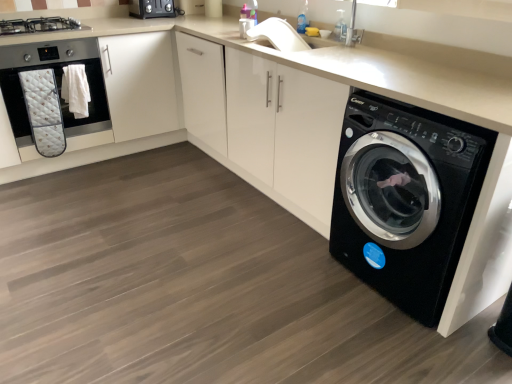
The width and height of the screenshot is (512, 384). Describe the element at coordinates (57, 84) in the screenshot. I see `matte black oven at left` at that location.

You are a GUI agent. You are given a task and a screenshot of the screen. Output one action in this format:
    pyautogui.click(x=<x>, y=<y>)
    Task: Click on the satin black toaster at upper center
    This screenshot has width=512, height=384.
    Given the screenshot: What is the action you would take?
    pyautogui.click(x=152, y=9)

In order to face satin black toaster at upper center, should I rotate leftwards or rightwards?

Turn left by 13.423 degrees to look at satin black toaster at upper center.

Identify the location of matte black oven at left. The image size is (512, 384). (57, 84).

Considering the positions of points (152, 14) and (24, 24), is point (152, 14) farther from camera compared to point (24, 24)?

Yes, it is behind point (24, 24).

From the image's perspective, is satin black toaster at upper center positioned above or below satin black stove at upper left?

satin black toaster at upper center is situated higher than satin black stove at upper left in the image.

Is satin black toaster at upper center positioned in front of satin black stove at upper left?

No, the depth of satin black toaster at upper center is greater than that of satin black stove at upper left.

Considering the sizes of objects satin black toaster at upper center and satin black stove at upper left in the image provided, who is taller, satin black toaster at upper center or satin black stove at upper left?

satin black toaster at upper center is taller.

Considering the positions of objects matte black oven at left and black glossy washing machine at lower right in the image provided, who is behind, matte black oven at left or black glossy washing machine at lower right?

matte black oven at left is further away from the camera.

Is matte black oven at left aimed at black glossy washing machine at lower right?

Yes, matte black oven at left is oriented towards black glossy washing machine at lower right.

Is point (41, 44) more distant than point (481, 181)?

Yes, it is behind point (481, 181).

Is matte black oven at left placed right next to black glossy washing machine at lower right?

matte black oven at left and black glossy washing machine at lower right are clearly separated.

Considering the sizes of objects matte black oven at left and satin black toaster at upper center in the image provided, who is wider, matte black oven at left or satin black toaster at upper center?

Wider between the two is matte black oven at left.

Can you confirm if matte black oven at left is bigger than satin black toaster at upper center?

Yes, matte black oven at left is bigger than satin black toaster at upper center.

Between point (62, 54) and point (134, 15), which one is positioned behind?

The point (134, 15) is more distant.

Between matte black oven at left and satin black toaster at upper center, which one is positioned in front?

matte black oven at left is more forward.

What's the angular difference between satin black toaster at upper center and black glossy washing machine at lower right's facing directions?

The facing directions of satin black toaster at upper center and black glossy washing machine at lower right are 90.1 degrees apart.

Is satin black toaster at upper center not inside black glossy washing machine at lower right?

That's correct, satin black toaster at upper center is outside of black glossy washing machine at lower right.

Identify the location of washing machine in front of the satin black toaster at upper center. This screenshot has height=384, width=512. (406, 199).

Considering the sizes of matte black oven at left and satin black stove at upper left in the image, is matte black oven at left wider or thinner than satin black stove at upper left?

In the image, matte black oven at left appears to be wider than satin black stove at upper left.

From a real-world perspective, is matte black oven at left physically above satin black stove at upper left?

Incorrect, from a real-world perspective, matte black oven at left is lower than satin black stove at upper left.

Is matte black oven at left positioned with its back to satin black stove at upper left?

No, matte black oven at left is not facing the opposite direction of satin black stove at upper left.

Considering the sizes of objects matte black oven at left and satin black stove at upper left in the image provided, who is smaller, matte black oven at left or satin black stove at upper left?

With smaller size is satin black stove at upper left.

Is black glossy washing machine at lower right taller or shorter than satin black stove at upper left?

In the image, black glossy washing machine at lower right appears to be taller than satin black stove at upper left.

Considering the relative sizes of black glossy washing machine at lower right and satin black stove at upper left in the image provided, is black glossy washing machine at lower right smaller than satin black stove at upper left?

No.

You are a GUI agent. You are given a task and a screenshot of the screen. Output one action in this format:
    pyautogui.click(x=<x>, y=<y>)
    Task: Click on the stove that appears above the black glossy washing machine at lower right (from the image's perspective)
    Image resolution: width=512 pixels, height=384 pixels.
    Given the screenshot: What is the action you would take?
    tap(40, 25)

In terms of width, does black glossy washing machine at lower right look wider or thinner when compared to satin black stove at upper left?

Clearly, black glossy washing machine at lower right has more width compared to satin black stove at upper left.

Is satin black toaster at upper center closer to the viewer compared to matte black oven at left?

No, the depth of satin black toaster at upper center is greater than that of matte black oven at left.

From the image's perspective, which one is positioned lower, satin black toaster at upper center or matte black oven at left?

matte black oven at left.

In the scene shown: How far apart are satin black toaster at upper center and matte black oven at left?

satin black toaster at upper center and matte black oven at left are 73.19 centimeters apart.

Is satin black toaster at upper center turned away from matte black oven at left?

satin black toaster at upper center does not have its back to matte black oven at left.

This screenshot has width=512, height=384. In the image, there is a satin black toaster at upper center. Identify the location of stove below it (from a real-world perspective). (40, 25).

Find the location of `home appliance above the black glossy washing machine at lower right (from a real-world perspective)`. home appliance above the black glossy washing machine at lower right (from a real-world perspective) is located at coordinates (57, 84).

Estimate the real-world distances between objects in this image. Which object is closer to black glossy washing machine at lower right, satin black toaster at upper center or satin black stove at upper left?

satin black toaster at upper center is positioned closer to the anchor black glossy washing machine at lower right.

Estimate the real-world distances between objects in this image. Which object is closer to satin black stove at upper left, satin black toaster at upper center or black glossy washing machine at lower right?

satin black toaster at upper center is closer to satin black stove at upper left.

Considering their positions, is black glossy washing machine at lower right positioned further to matte black oven at left than satin black toaster at upper center?

Based on the image, black glossy washing machine at lower right appears to be further to matte black oven at left.

Estimate the real-world distances between objects in this image. Which object is further from satin black toaster at upper center, black glossy washing machine at lower right or satin black stove at upper left?

The object further to satin black toaster at upper center is black glossy washing machine at lower right.

From the image, which object appears to be nearer to black glossy washing machine at lower right, matte black oven at left or satin black toaster at upper center?

matte black oven at left lies closer to black glossy washing machine at lower right than the other object.

Based on the photo, looking at the image, which one is located further to matte black oven at left, satin black toaster at upper center or black glossy washing machine at lower right?

black glossy washing machine at lower right is positioned further to the anchor matte black oven at left.

From the image, which object appears to be nearer to matte black oven at left, satin black stove at upper left or black glossy washing machine at lower right?

Among the two, satin black stove at upper left is located nearer to matte black oven at left.

Considering their positions, is satin black stove at upper left positioned further to black glossy washing machine at lower right than satin black toaster at upper center?

satin black stove at upper left is further to black glossy washing machine at lower right.

What are the coordinates of `stove between matte black oven at left and satin black toaster at upper center in the horizontal direction` in the screenshot? It's located at (40, 25).

Identify the location of stove between matte black oven at left and black glossy washing machine at lower right. The width and height of the screenshot is (512, 384). (40, 25).

Locate an element on the screen. appliance between matte black oven at left and black glossy washing machine at lower right from left to right is located at coordinates (152, 9).

Where is `appliance situated between satin black stove at upper left and black glossy washing machine at lower right from left to right`? Image resolution: width=512 pixels, height=384 pixels. appliance situated between satin black stove at upper left and black glossy washing machine at lower right from left to right is located at coordinates (152, 9).